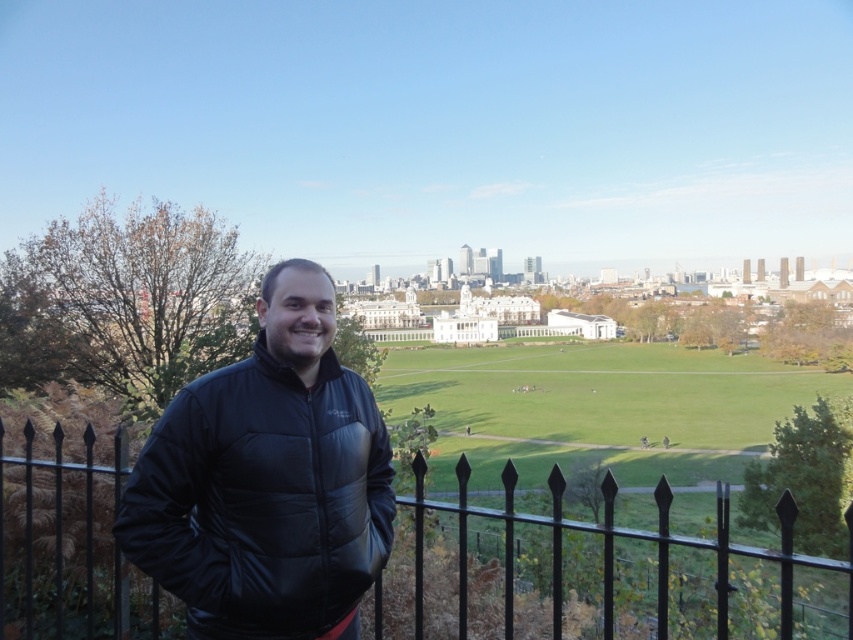
Is black synthetic jacket at left wider than black metal fence at center?

No.

Which of these two, black synthetic jacket at left or black metal fence at center, stands taller?

With more height is black synthetic jacket at left.

Image resolution: width=853 pixels, height=640 pixels. Describe the element at coordinates (263, 499) in the screenshot. I see `black synthetic jacket at left` at that location.

The width and height of the screenshot is (853, 640). In order to click on black synthetic jacket at left in this screenshot , I will do point(263,499).